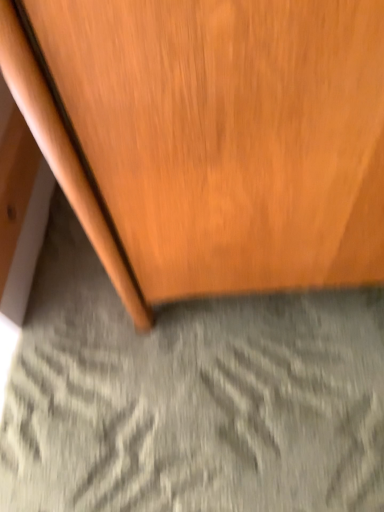
What is the approximate width of wooden cabinet at upper left?

wooden cabinet at upper left is 18.08 inches in width.

Locate an element on the screen. This screenshot has height=512, width=384. wooden cabinet at upper left is located at coordinates (210, 137).

Measure the distance between point (320, 160) and camera.

13.35 inches.

What do you see at coordinates (210, 137) in the screenshot? I see `wooden cabinet at upper left` at bounding box center [210, 137].

Locate an element on the screen. wooden cabinet at upper left is located at coordinates (210, 137).